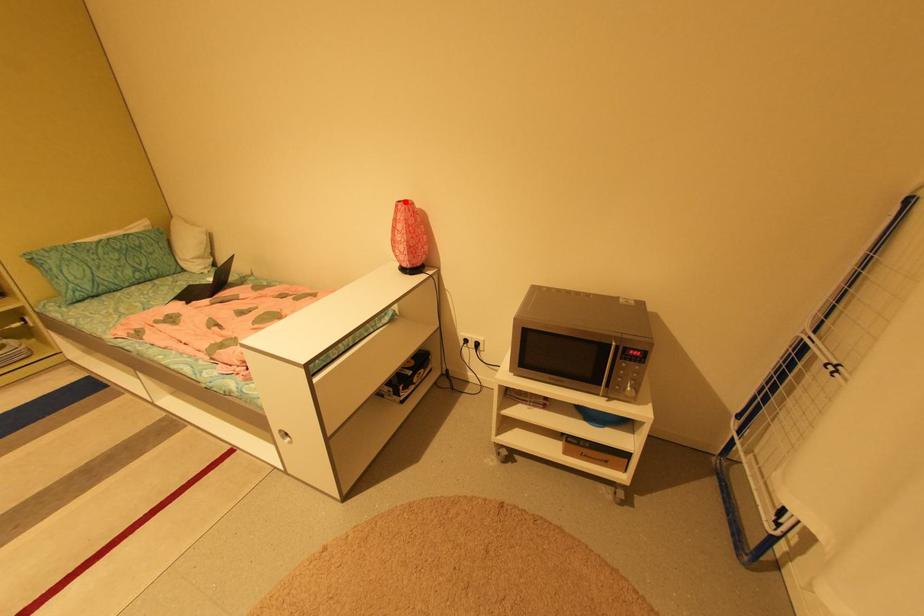
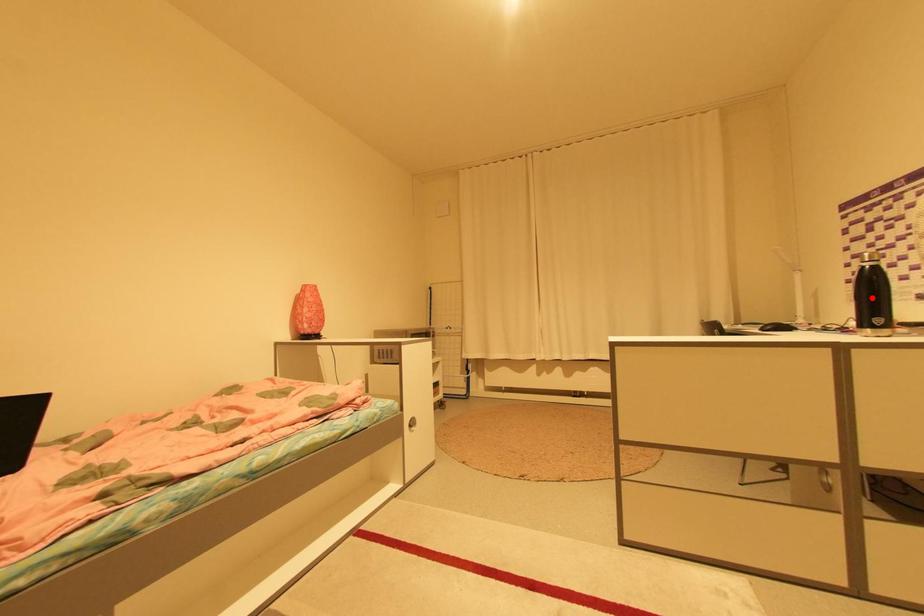
I am providing you with two images of the same scene from different viewpoints. A red point is marked on the first image and another point is marked on the second image. Is the red point in image1 aligned with the point shown in image2?

No